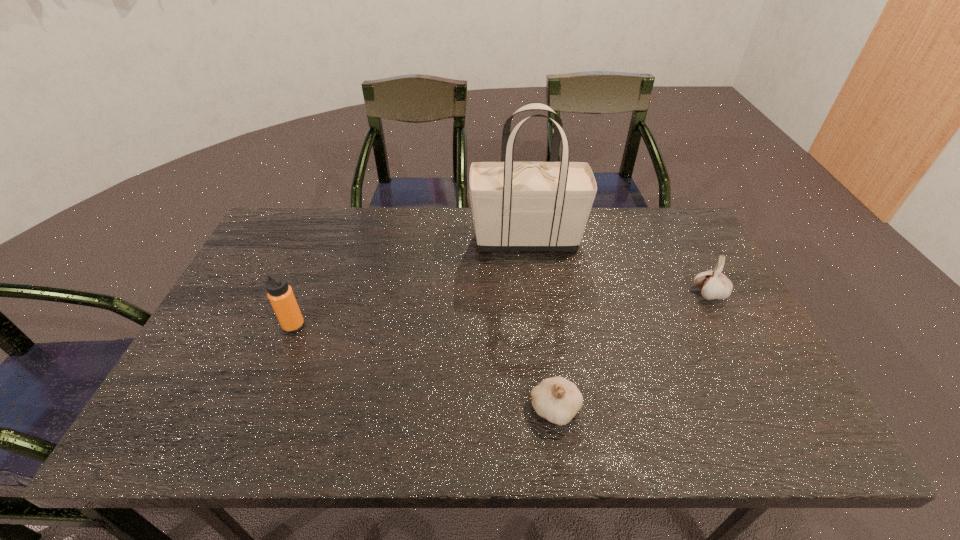
At what (x,y) coordinates should I click in order to perform the action: click on vacant area that lies between the tallest object and the shortest object. Please return your answer as a coordinate pair (x, y). Looking at the image, I should click on (540, 324).

Identify the location of empty space between the farther garlic and the third shortest object. Image resolution: width=960 pixels, height=540 pixels. (502, 309).

Identify which object is the second nearest to the nearer garlic. Please provide its 2D coordinates. Your answer should be formatted as a tuple, i.e. [(x, y)], where the tuple contains the x and y coordinates of a point satisfying the conditions above.

[(517, 206)]

Select which object appears as the third closest to the rightmost object. Please provide its 2D coordinates. Your answer should be formatted as a tuple, i.e. [(x, y)], where the tuple contains the x and y coordinates of a point satisfying the conditions above.

[(280, 294)]

Find the location of a particular element. free location that satisfies the following two spatial constraints: 1. on the back side of the left garlic; 2. with handles facing forward on the farthest object is located at coordinates (532, 239).

Where is `free point that satisfies the following two spatial constraints: 1. with handles facing forward on the farther garlic; 2. on the right side of the tallest object`? free point that satisfies the following two spatial constraints: 1. with handles facing forward on the farther garlic; 2. on the right side of the tallest object is located at coordinates (533, 294).

The image size is (960, 540). Find the location of `vacant area that satisfies the following two spatial constraints: 1. on the back side of the left garlic; 2. with handles facing forward on the shopping bag`. vacant area that satisfies the following two spatial constraints: 1. on the back side of the left garlic; 2. with handles facing forward on the shopping bag is located at coordinates (532, 239).

Where is `vacant space that satisfies the following two spatial constraints: 1. with handles facing forward on the shopping bag; 2. on the back side of the nearer garlic`? Image resolution: width=960 pixels, height=540 pixels. vacant space that satisfies the following two spatial constraints: 1. with handles facing forward on the shopping bag; 2. on the back side of the nearer garlic is located at coordinates (547, 409).

Locate an element on the screen. free spot that satisfies the following two spatial constraints: 1. with handles facing forward on the tallest object; 2. on the right side of the right garlic is located at coordinates (533, 294).

The height and width of the screenshot is (540, 960). I want to click on blank area in the image that satisfies the following two spatial constraints: 1. on the back side of the thermos bottle; 2. on the right side of the second farthest object, so click(306, 294).